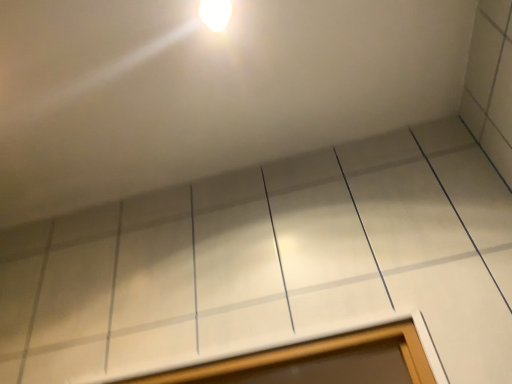
Question: From a real-world perspective, is white glossy window at lower center positioned above or below white glossy light fixture at upper center?

Choices:
 (A) below
 (B) above

Answer: (A)

Question: Considering the positions of white glossy window at lower center and white glossy light fixture at upper center in the image, is white glossy window at lower center wider or thinner than white glossy light fixture at upper center?

Choices:
 (A) thin
 (B) wide

Answer: (A)

Question: Visually, is white glossy window at lower center positioned to the left or to the right of white glossy light fixture at upper center?

Choices:
 (A) right
 (B) left

Answer: (A)

Question: Considering the positions of point (223, 21) and point (361, 345), is point (223, 21) closer or farther from the camera than point (361, 345)?

Choices:
 (A) closer
 (B) farther

Answer: (B)

Question: Is white glossy light fixture at upper center bigger or smaller than white glossy window at lower center?

Choices:
 (A) big
 (B) small

Answer: (B)

Question: Considering the positions of white glossy light fixture at upper center and white glossy window at lower center in the image, is white glossy light fixture at upper center wider or thinner than white glossy window at lower center?

Choices:
 (A) wide
 (B) thin

Answer: (A)

Question: Considering the positions of white glossy light fixture at upper center and white glossy window at lower center in the image, is white glossy light fixture at upper center taller or shorter than white glossy window at lower center?

Choices:
 (A) tall
 (B) short

Answer: (B)